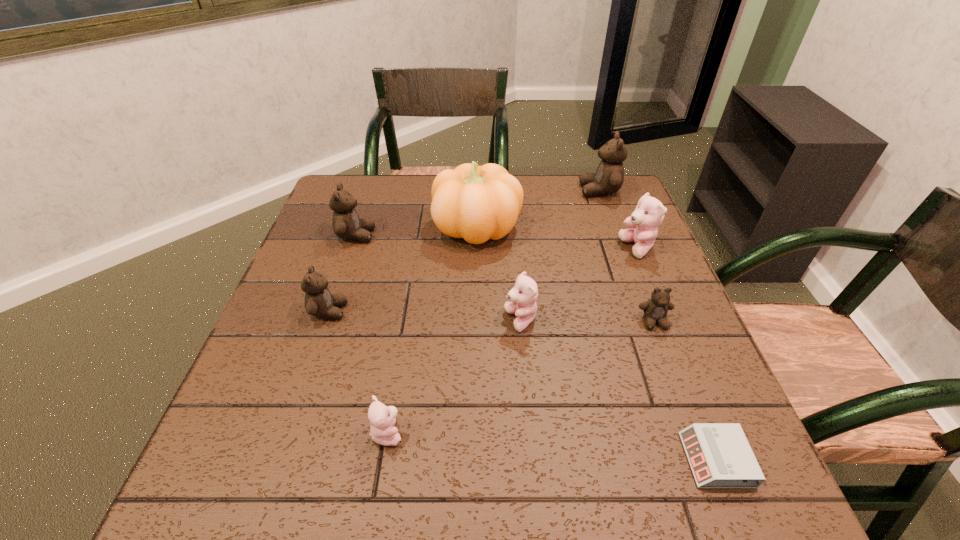
Identify the location of pumpkin. The width and height of the screenshot is (960, 540). (477, 203).

Locate an element on the screen. The image size is (960, 540). the tallest teddy bear is located at coordinates (609, 177).

Find the location of a particular element. the farthest brown teddy bear is located at coordinates (609, 177).

Locate an element on the screen. This screenshot has width=960, height=540. the farthest pink teddy bear is located at coordinates (649, 213).

This screenshot has width=960, height=540. Identify the location of the rightmost pink teddy bear. (649, 213).

Find the location of a particular element. This screenshot has width=960, height=540. the third smallest brown teddy bear is located at coordinates (346, 224).

Where is `the second smallest brown teddy bear`? This screenshot has height=540, width=960. the second smallest brown teddy bear is located at coordinates (319, 301).

Locate an element on the screen. The image size is (960, 540). the second smallest pink teddy bear is located at coordinates (523, 296).

The width and height of the screenshot is (960, 540). In order to click on the second nearest pink teddy bear in this screenshot , I will do `click(523, 296)`.

The height and width of the screenshot is (540, 960). In order to click on the smallest brown teddy bear in this screenshot , I will do `click(655, 309)`.